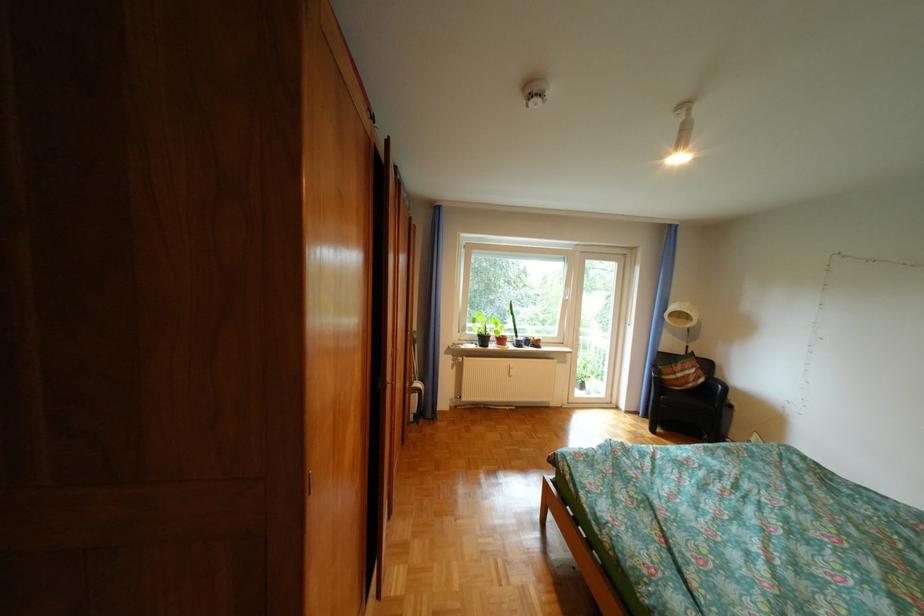
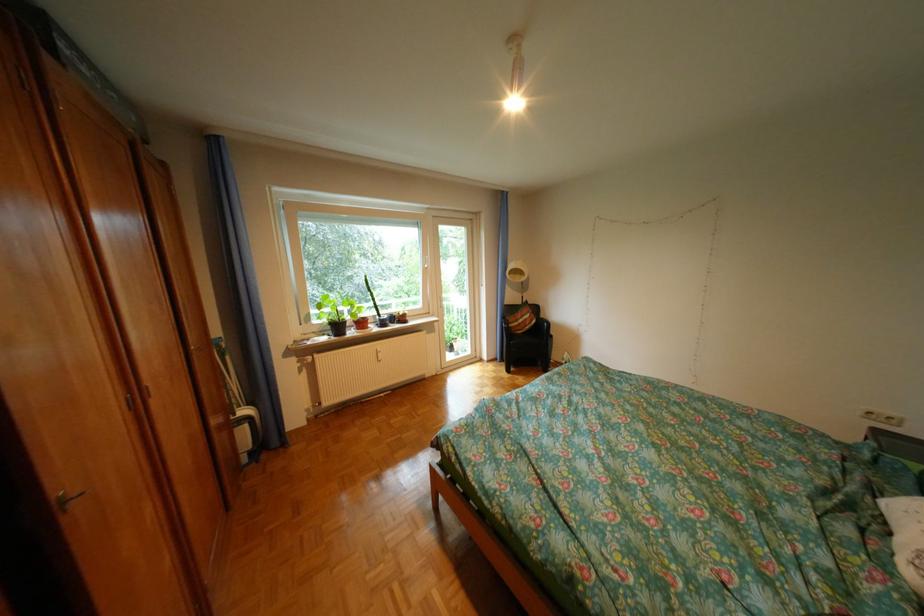
Question: The camera is either moving clockwise (left) or counter-clockwise (right) around the object. The first image is from the beginning of the video and the second image is from the end. Is the camera moving left or right when shooting the video?

Choices:
 (A) Left
 (B) Right

Answer: (A)